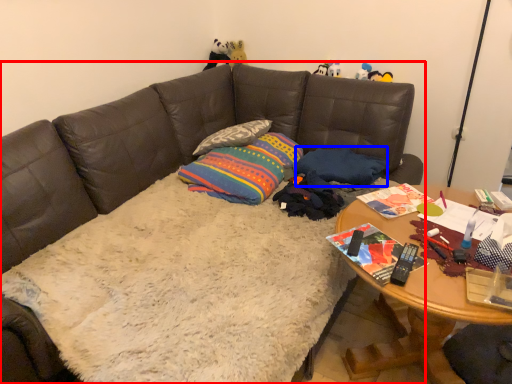
Question: Which object appears farthest to the camera in this image, studio couch (highlighted by a red box) or pillow (highlighted by a blue box)?

Choices:
 (A) studio couch
 (B) pillow

Answer: (B)